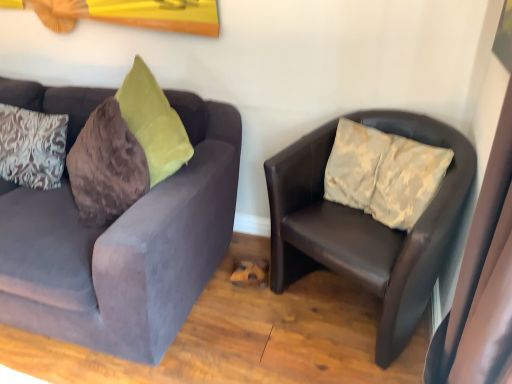
Question: Does leather chair at right, acting as the 1th studio couch starting from the right, lie in front of white damask pillow at left?

Choices:
 (A) yes
 (B) no

Answer: (A)

Question: Could you tell me if leather chair at right, acting as the 1th studio couch starting from the right, is turned towards white damask pillow at left?

Choices:
 (A) no
 (B) yes

Answer: (A)

Question: Is leather chair at right, acting as the 1th studio couch starting from the right, not within white damask pillow at left?

Choices:
 (A) yes
 (B) no

Answer: (A)

Question: Is leather chair at right, acting as the 1th studio couch starting from the right, thinner than white damask pillow at left?

Choices:
 (A) no
 (B) yes

Answer: (A)

Question: From a real-world perspective, is leather chair at right, the 2th studio couch viewed from the left, physically below white damask pillow at left?

Choices:
 (A) yes
 (B) no

Answer: (A)

Question: Considering the relative sizes of leather chair at right, acting as the 1th studio couch starting from the right, and white damask pillow at left in the image provided, is leather chair at right, acting as the 1th studio couch starting from the right, taller than white damask pillow at left?

Choices:
 (A) yes
 (B) no

Answer: (A)

Question: From a real-world perspective, is velvet gray couch at left, which ranks as the first studio couch in left-to-right order, located beneath leather chair at right, the 2th studio couch viewed from the left?

Choices:
 (A) no
 (B) yes

Answer: (A)

Question: Considering the relative sizes of velvet gray couch at left, the 2th studio couch viewed from the right, and leather chair at right, acting as the 1th studio couch starting from the right, in the image provided, is velvet gray couch at left, the 2th studio couch viewed from the right, shorter than leather chair at right, acting as the 1th studio couch starting from the right,?

Choices:
 (A) no
 (B) yes

Answer: (A)

Question: Are velvet gray couch at left, the 2th studio couch viewed from the right, and leather chair at right, the 2th studio couch viewed from the left, located far from each other?

Choices:
 (A) no
 (B) yes

Answer: (A)

Question: Is velvet gray couch at left, which ranks as the first studio couch in left-to-right order, further to the viewer compared to leather chair at right, the 2th studio couch viewed from the left?

Choices:
 (A) yes
 (B) no

Answer: (B)

Question: Is velvet gray couch at left, the 2th studio couch viewed from the right, wider than leather chair at right, the 2th studio couch viewed from the left?

Choices:
 (A) no
 (B) yes

Answer: (B)

Question: Is velvet gray couch at left, the 2th studio couch viewed from the right, facing towards leather chair at right, the 2th studio couch viewed from the left?

Choices:
 (A) no
 (B) yes

Answer: (A)

Question: Does velvet gray couch at left, which ranks as the first studio couch in left-to-right order, have a lesser height compared to white damask pillow at left?

Choices:
 (A) no
 (B) yes

Answer: (A)